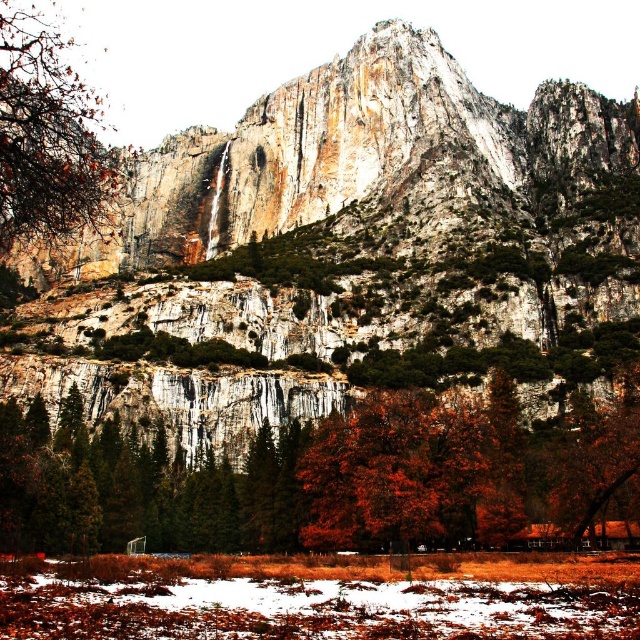
Question: Can you confirm if rocky cliff at center is thinner than smooth brown tree trunk at left?

Choices:
 (A) no
 (B) yes

Answer: (A)

Question: Does rocky cliff at center have a smaller size compared to orange leafy tree at center?

Choices:
 (A) no
 (B) yes

Answer: (A)

Question: Which is nearer to the rocky cliff at center?

Choices:
 (A) orange leafy tree at center
 (B) smooth brown tree trunk at left

Answer: (A)

Question: Estimate the real-world distances between objects in this image. Which object is farther from the smooth brown tree trunk at left?

Choices:
 (A) rocky cliff at center
 (B) orange leafy tree at center

Answer: (B)

Question: Does rocky cliff at center appear under orange leafy tree at center?

Choices:
 (A) no
 (B) yes

Answer: (A)

Question: Which object is positioned farthest from the smooth brown tree trunk at left?

Choices:
 (A) rocky cliff at center
 (B) orange leafy tree at center

Answer: (B)